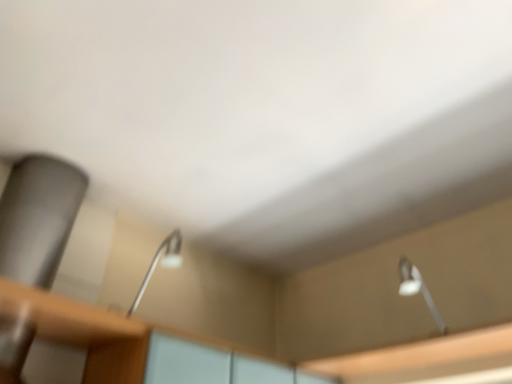
Question: In the image, is white glossy lamp at upper right, positioned as the second lamp in left-to-right order, positioned in front of or behind metallic silver lamp at center, positioned as the 2th lamp in right-to-left order?

Choices:
 (A) front
 (B) behind

Answer: (B)

Question: Is point (402, 258) closer or farther from the camera than point (170, 233)?

Choices:
 (A) farther
 (B) closer

Answer: (A)

Question: Which is nearer to the white glossy lamp at upper right, arranged as the first lamp when viewed from the right?

Choices:
 (A) metallic silver lamp at center, positioned as the 2th lamp in right-to-left order
 (B) wooden table at lower left

Answer: (A)

Question: Which is nearer to the metallic silver lamp at center, which is counted as the 1th lamp, starting from the left?

Choices:
 (A) wooden table at lower left
 (B) white glossy lamp at upper right, arranged as the first lamp when viewed from the right

Answer: (A)